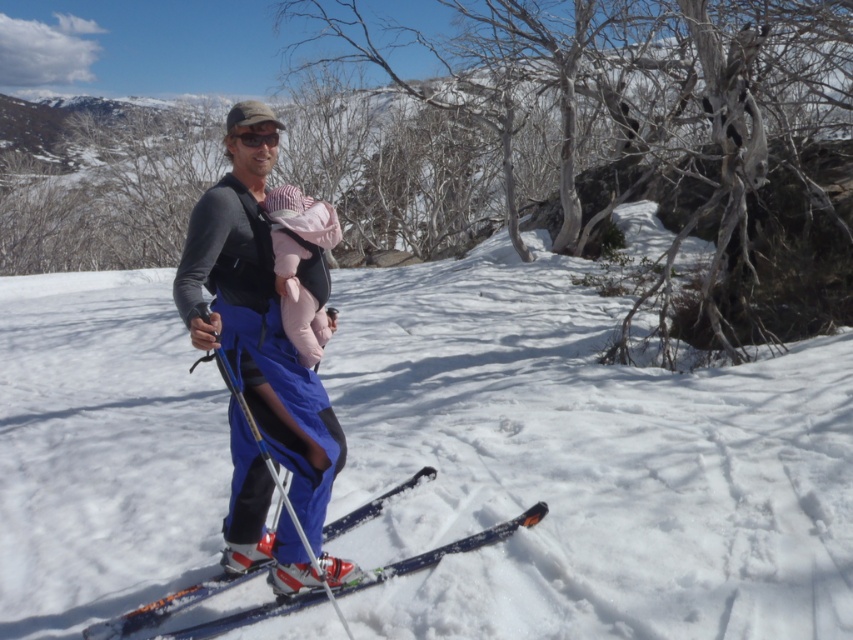
Question: Which of the following is the farthest from the observer?

Choices:
 (A) (258, 323)
 (B) (306, 336)

Answer: (B)

Question: Which object appears farthest from the camera in this image?

Choices:
 (A) matte blue ski suit at center
 (B) black matte goggles at center
 (C) pink fleece baby carrier at center
 (D) blue metallic ski at center

Answer: (C)

Question: Which object is positioned farthest from the matte blue ski suit at center?

Choices:
 (A) metallic silver ski pole at center
 (B) black matte goggles at center
 (C) blue metallic ski at center

Answer: (B)

Question: Can you confirm if blue metallic ski at center is wider than black matte goggles at center?

Choices:
 (A) no
 (B) yes

Answer: (B)

Question: Is white fluffy snow at center bigger than pink fleece baby carrier at center?

Choices:
 (A) no
 (B) yes

Answer: (B)

Question: Can you confirm if blue metallic ski at center is positioned to the left of black matte goggles at center?

Choices:
 (A) no
 (B) yes

Answer: (A)